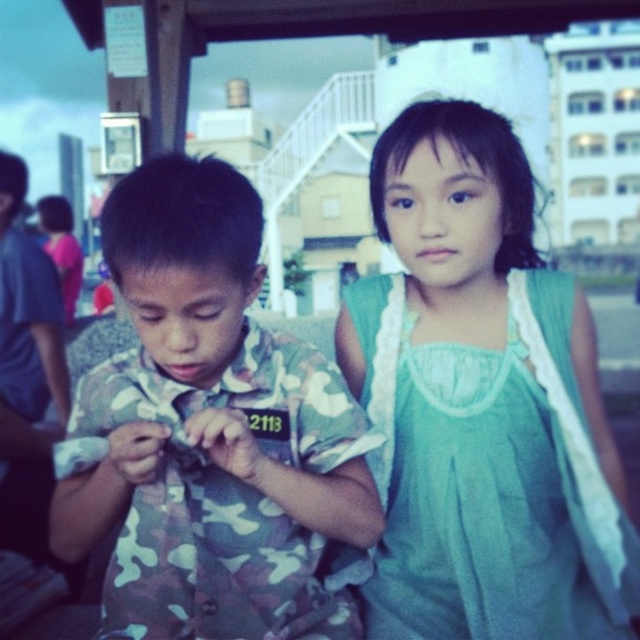
Question: Does green sheer dress at center lie behind camouflage fabric shirt at center?

Choices:
 (A) no
 (B) yes

Answer: (B)

Question: Which object appears closest to the camera in this image?

Choices:
 (A) camouflage fabric shirt at center
 (B) green sheer dress at center

Answer: (A)

Question: Which of the following is the closest to the observer?

Choices:
 (A) camouflage fabric shirt at center
 (B) green sheer dress at center

Answer: (A)

Question: From the image, what is the correct spatial relationship of green sheer dress at center in relation to camouflage fabric shirt at center?

Choices:
 (A) above
 (B) below

Answer: (A)

Question: Which of the following is the farthest from the observer?

Choices:
 (A) (289, 426)
 (B) (502, 193)

Answer: (B)

Question: Does green sheer dress at center appear under camouflage fabric shirt at center?

Choices:
 (A) no
 (B) yes

Answer: (A)